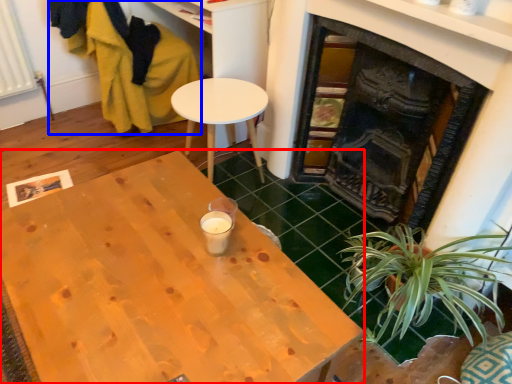
Question: Which point is further to the camera, desk (highlighted by a red box) or swivel chair (highlighted by a blue box)?

Choices:
 (A) desk
 (B) swivel chair

Answer: (B)